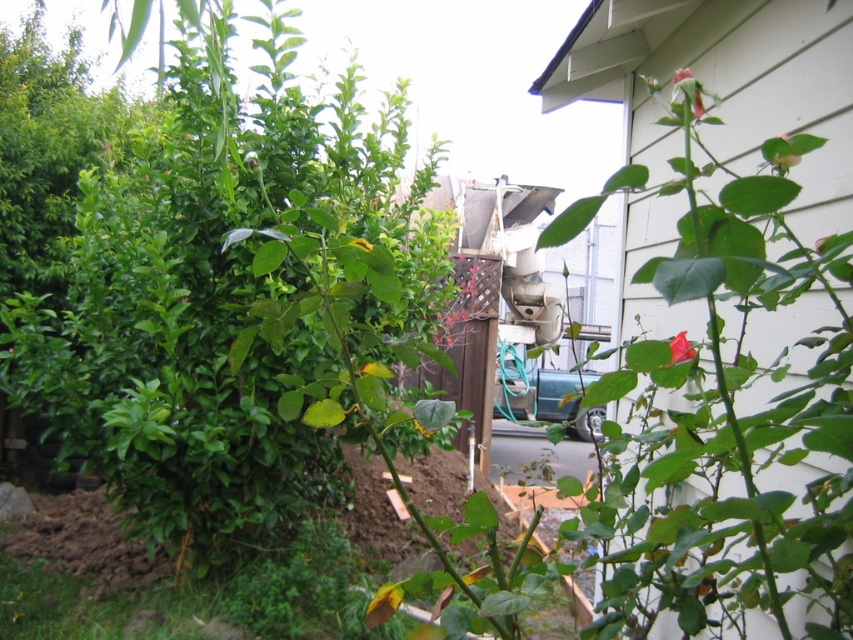
Does green leafy bush at center appear over green matte leaf at center?

No.

Is the position of green leafy bush at center more distant than that of green matte leaf at center?

Yes, green leafy bush at center is behind green matte leaf at center.

Measure the distance between green leafy bush at center and camera.

green leafy bush at center and camera are 6.55 feet apart from each other.

I want to click on green leafy bush at center, so click(218, 298).

Can you confirm if green leafy bush at center is shorter than green matte rose at upper right?

No, green leafy bush at center is not shorter than green matte rose at upper right.

Does point (141, 444) come in front of point (780, 138)?

No, (141, 444) is further to viewer.

Image resolution: width=853 pixels, height=640 pixels. I want to click on green leafy bush at center, so click(x=218, y=298).

Does matte red rose at center right have a greater width compared to pink matte rosebud at upper right?

Indeed, matte red rose at center right has a greater width compared to pink matte rosebud at upper right.

Can you confirm if matte red rose at center right is taller than pink matte rosebud at upper right?

No.

Between point (682, 353) and point (699, 99), which one is positioned behind?

The point (682, 353) is more distant.

Locate an element on the screen. Image resolution: width=853 pixels, height=640 pixels. matte red rose at center right is located at coordinates (680, 348).